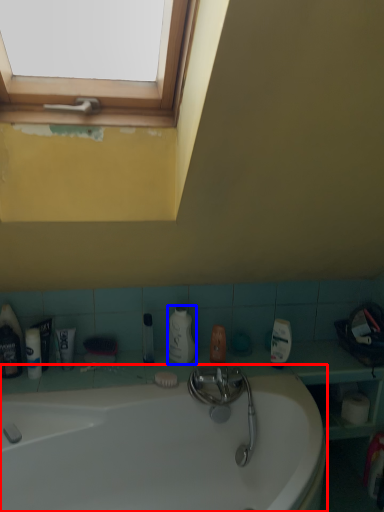
Question: Which object appears farthest to the camera in this image, bathtub (highlighted by a red box) or cleaning product (highlighted by a blue box)?

Choices:
 (A) bathtub
 (B) cleaning product

Answer: (B)